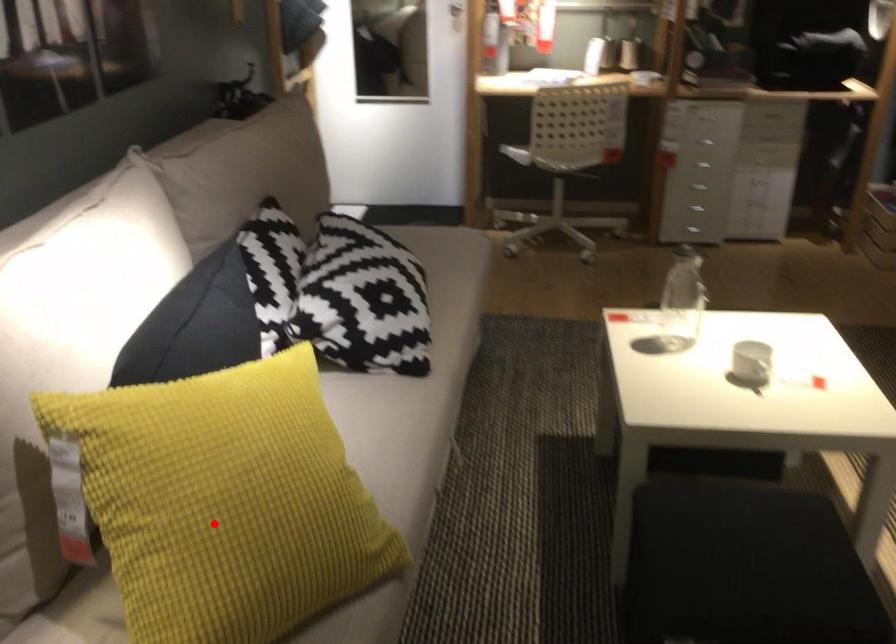
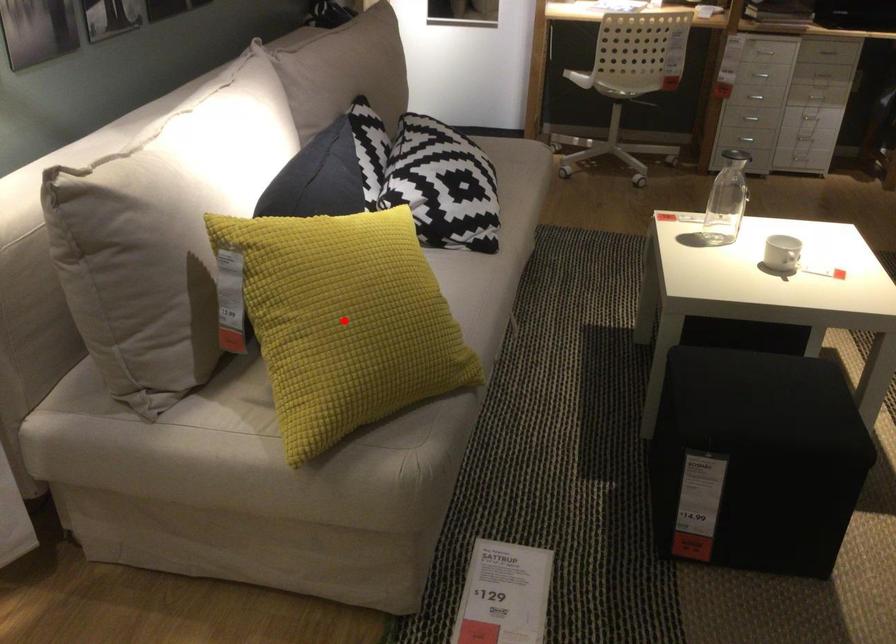
I am providing you with two images of the same scene from different viewpoints. A red point is marked on the first image and another point is marked on the second image. Does the point marked in image1 correspond to the same location as the one in image2?

Yes